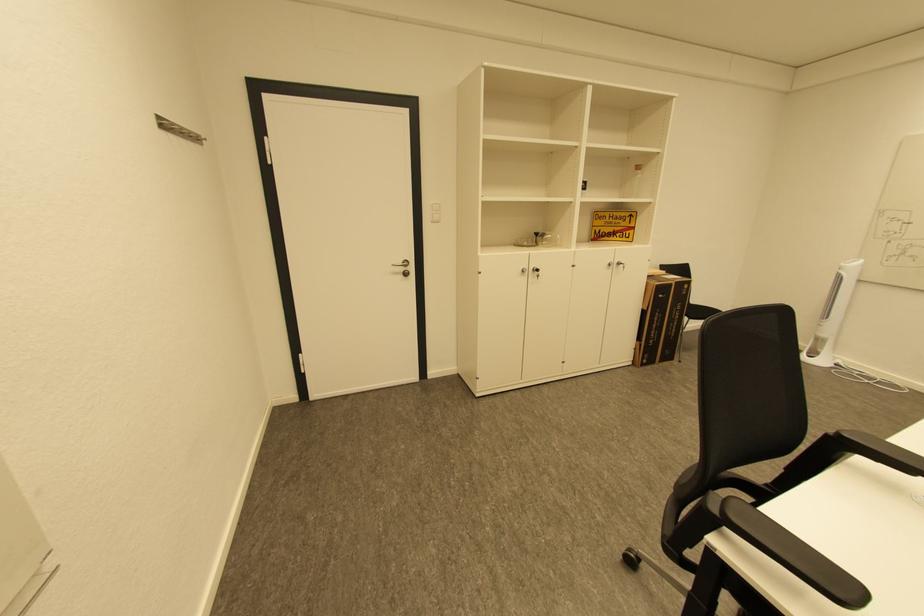
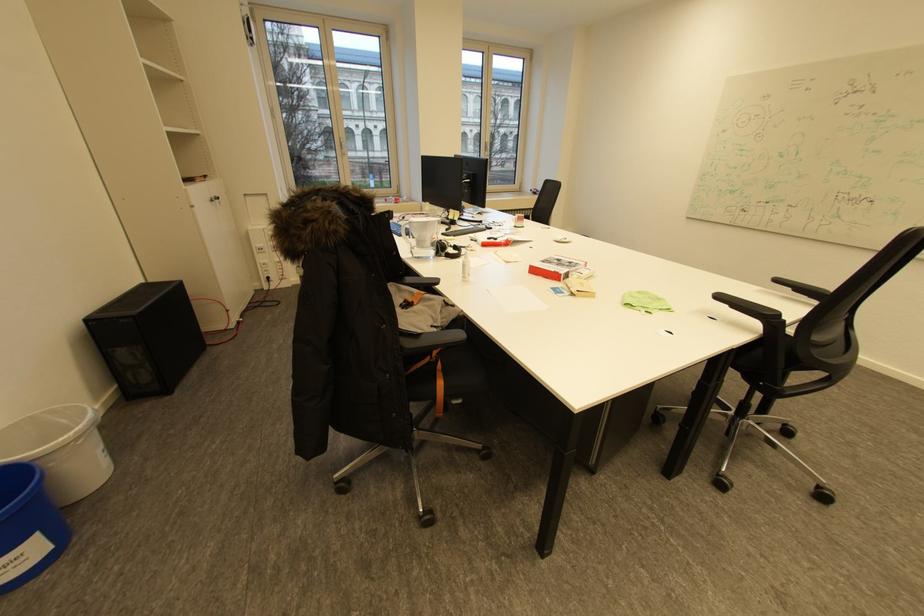
Question: I am providing you with two images of the same scene from different viewpoints. After the viewpoint changes to image2, which objects are now occluded?

Choices:
 (A) white spray bottle
 (B) glass water pitcher
 (C) red cardboard box
 (D) none of these

Answer: (D)